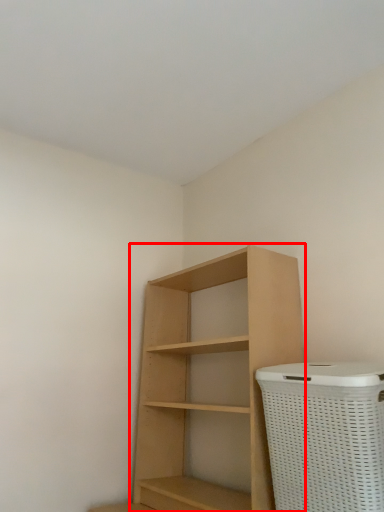
Question: From the image's perspective, where is shelf (annotated by the red box) located in relation to basket container in the image?

Choices:
 (A) above
 (B) below

Answer: (A)